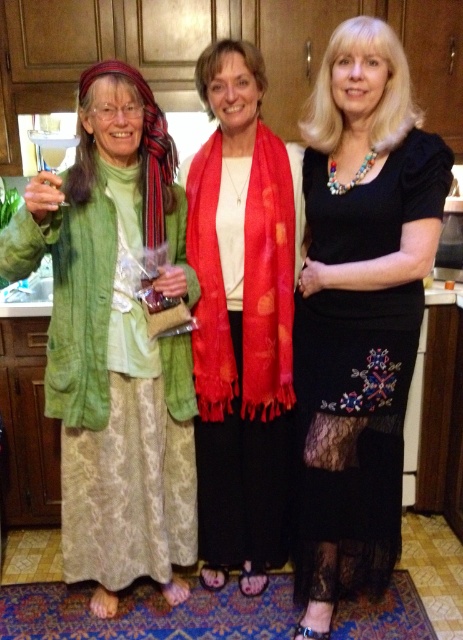
You are a photographer setting up for a group photo. You notice the black lace dress at center and the silky red scarf at center in the scene. Which object should you focus on first to ensure both are in sharp focus?

You should focus on the black lace dress at center first because it is closer to the viewer than the silky red scarf at center, so adjusting focus from near to far will help both be in sharp focus.

Consider the image. You are standing at point (358, 216) and want to move to point (74, 445). Is the path between these two points clear?

Yes, the path between point (358, 216) and point (74, 445) is clear because point (74, 445) is behind point (358, 216), indicating they are along the same line of sight without obstruction.

You are trying to decide which item to grab first from the scene. Since the green textured cardigan at left and silky red scarf at center are both within reach, which one is shorter in height?

The green textured cardigan at left has a lesser height compared to silky red scarf at center, so the green textured cardigan at left is shorter in height.